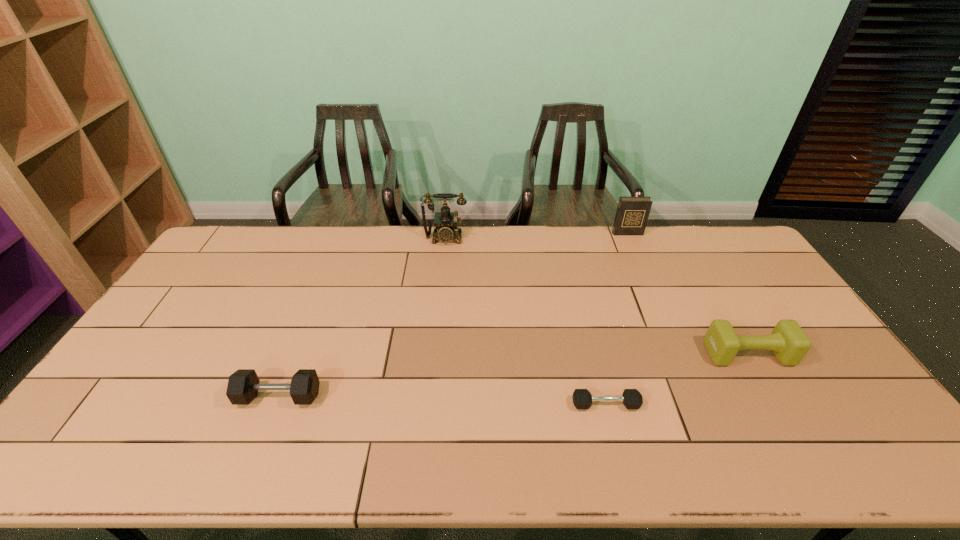
In the image, there is a desktop. Where is `vacant region at the far right corner`? The width and height of the screenshot is (960, 540). vacant region at the far right corner is located at coordinates (742, 247).

This screenshot has height=540, width=960. In the image, there is a desktop. Find the location of `free space at the near right corner`. free space at the near right corner is located at coordinates [x=857, y=465].

I want to click on free point between the rightmost object and the tallest object, so pyautogui.click(x=597, y=296).

Locate an element on the screen. This screenshot has height=540, width=960. vacant area that lies between the shortest object and the fourth object from right to left is located at coordinates (525, 322).

You are a GUI agent. You are given a task and a screenshot of the screen. Output one action in this format:
    pyautogui.click(x=<x>, y=<y>)
    Task: Click on the vacant space that is in between the leftmost object and the fourth shortest object
    
    Given the screenshot: What is the action you would take?
    pyautogui.click(x=453, y=315)

I want to click on vacant space that's between the third object from right to left and the third nearest object, so click(x=677, y=379).

Identify the location of free spot between the leftmost dumbbell and the rightmost dumbbell. (514, 375).

Where is `unoccupied area between the telephone and the farthest dumbbell`? The width and height of the screenshot is (960, 540). unoccupied area between the telephone and the farthest dumbbell is located at coordinates (597, 296).

Where is `vacant area that lies between the second dumbbell from right to left and the tallest object`? vacant area that lies between the second dumbbell from right to left and the tallest object is located at coordinates (525, 322).

You are a GUI agent. You are given a task and a screenshot of the screen. Output one action in this format:
    pyautogui.click(x=<x>, y=<y>)
    Task: Click on the vacant point located between the farthest dumbbell and the telephone
    
    Given the screenshot: What is the action you would take?
    tap(597, 296)